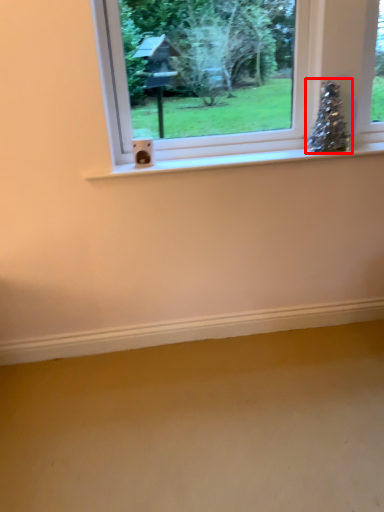
Question: From the image's perspective, where is christmas tree (annotated by the red box) located in relation to window in the image?

Choices:
 (A) below
 (B) above

Answer: (A)